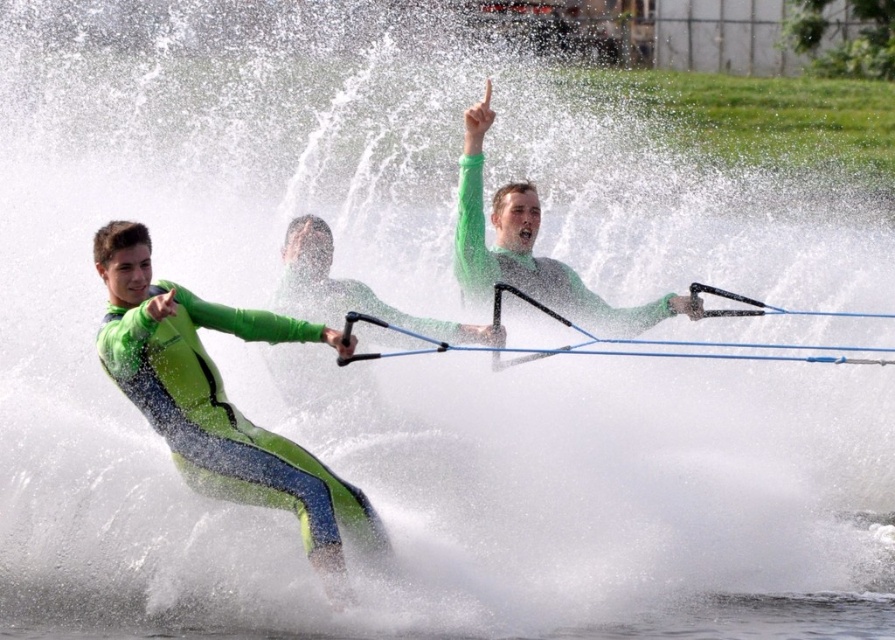
You are a photographer standing at the camera position. You want to take a photo of the water skiers. There is a point at coordinates point (x=135, y=246) that is 16.08 meters away from you. If your camera has a focal length of 50mm and you want to focus on this point, what should be the focus distance setting on your camera?

The focus distance setting should be set to 16.08 meters to focus on the point (x=135, y=246).

You are a photographer trying to capture a photo of the green neoprene wetsuit at left and the green matte wetsuit at center. From the perspective of someone standing on the shore, which wetsuit should you focus on first to ensure both are in frame?

The green neoprene wetsuit at left is to the left of the green matte wetsuit at center, so you should focus on the green neoprene wetsuit at left first to ensure both are in frame.